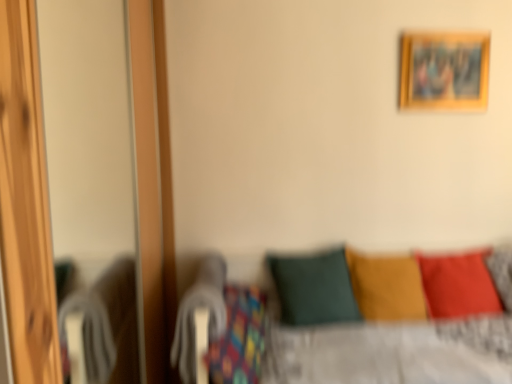
This screenshot has width=512, height=384. Identify the location of matte red pillow at lower right, positioned as the 3th pillow in left-to-right order. (458, 285).

What do you see at coordinates (444, 71) in the screenshot?
I see `wooden picture frame at upper right` at bounding box center [444, 71].

How much space does dark green fabric pillow at center, marked as the 1th pillow in a left-to-right arrangement, occupy horizontally?

The width of dark green fabric pillow at center, marked as the 1th pillow in a left-to-right arrangement, is 16.09 inches.

The width and height of the screenshot is (512, 384). I want to click on wooden screen door at left, so click(x=25, y=200).

The height and width of the screenshot is (384, 512). Find the location of `velvet yellow pillow at center, which is the second pillow in right-to-left order`. velvet yellow pillow at center, which is the second pillow in right-to-left order is located at coordinates (387, 286).

From a real-world perspective, who is located higher, wooden picture frame at upper right or wooden screen door at left?

wooden picture frame at upper right.

Is wooden picture frame at upper right situated inside wooden screen door at left or outside?

wooden picture frame at upper right is not inside wooden screen door at left, it's outside.

Considering the positions of point (482, 35) and point (34, 39), is point (482, 35) closer or farther from the camera than point (34, 39)?

Point (482, 35) is positioned farther from the camera compared to point (34, 39).

Considering the positions of objects velvet yellow pillow at center, marked as the 2th pillow in a left-to-right arrangement, and wooden picture frame at upper right in the image provided, who is more to the right, velvet yellow pillow at center, marked as the 2th pillow in a left-to-right arrangement, or wooden picture frame at upper right?

wooden picture frame at upper right.

Does point (371, 308) appear closer or farther from the camera than point (465, 61)?

Point (371, 308) is closer to the camera than point (465, 61).

Is velvet yellow pillow at center, which is the second pillow in right-to-left order, oriented away from wooden picture frame at upper right?

No, velvet yellow pillow at center, which is the second pillow in right-to-left order,'s orientation is not away from wooden picture frame at upper right.

How different are the orientations of velvet yellow pillow at center, marked as the 2th pillow in a left-to-right arrangement, and wooden picture frame at upper right in degrees?

The angular difference between velvet yellow pillow at center, marked as the 2th pillow in a left-to-right arrangement, and wooden picture frame at upper right is 2.82 degrees.

From the picture: Could you tell me if wooden screen door at left is facing dark green fabric pillow at center, placed as the 3th pillow when sorted from right to left?

Yes, wooden screen door at left faces towards dark green fabric pillow at center, placed as the 3th pillow when sorted from right to left.

Identify the location of screen door located in front of the dark green fabric pillow at center, marked as the 1th pillow in a left-to-right arrangement. (25, 200).

Can you confirm if wooden screen door at left is thinner than dark green fabric pillow at center, placed as the 3th pillow when sorted from right to left?

In fact, wooden screen door at left might be wider than dark green fabric pillow at center, placed as the 3th pillow when sorted from right to left.

Does wooden screen door at left lie behind dark green fabric pillow at center, marked as the 1th pillow in a left-to-right arrangement?

No, wooden screen door at left is closer to the camera.

Is matte red pillow at lower right, positioned as the 3th pillow in left-to-right order, to the right of dark green fabric pillow at center, marked as the 1th pillow in a left-to-right arrangement, from the viewer's perspective?

Indeed, matte red pillow at lower right, positioned as the 3th pillow in left-to-right order, is positioned on the right side of dark green fabric pillow at center, marked as the 1th pillow in a left-to-right arrangement.

Which object is further away from the camera, matte red pillow at lower right, positioned as the 3th pillow in left-to-right order, or dark green fabric pillow at center, marked as the 1th pillow in a left-to-right arrangement?

Positioned behind is matte red pillow at lower right, positioned as the 3th pillow in left-to-right order.

Considering the relative sizes of matte red pillow at lower right, positioned as the 3th pillow in left-to-right order, and dark green fabric pillow at center, marked as the 1th pillow in a left-to-right arrangement, in the image provided, is matte red pillow at lower right, positioned as the 3th pillow in left-to-right order, bigger than dark green fabric pillow at center, marked as the 1th pillow in a left-to-right arrangement,?

Actually, matte red pillow at lower right, positioned as the 3th pillow in left-to-right order, might be smaller than dark green fabric pillow at center, marked as the 1th pillow in a left-to-right arrangement.

What's the angular difference between matte red pillow at lower right, which appears as the 1th pillow when viewed from the right, and dark green fabric pillow at center, placed as the 3th pillow when sorted from right to left,'s facing directions?

8.66 degrees.

From a real-world perspective, is wooden picture frame at upper right under velvet yellow pillow at center, marked as the 2th pillow in a left-to-right arrangement?

No, from a real-world perspective, wooden picture frame at upper right is not under velvet yellow pillow at center, marked as the 2th pillow in a left-to-right arrangement.

Considering the sizes of objects wooden picture frame at upper right and velvet yellow pillow at center, which is the second pillow in right-to-left order, in the image provided, who is bigger, wooden picture frame at upper right or velvet yellow pillow at center, which is the second pillow in right-to-left order,?

velvet yellow pillow at center, which is the second pillow in right-to-left order, is bigger.

Image resolution: width=512 pixels, height=384 pixels. In order to click on pillow that is the 1st one when counting leftward from the wooden picture frame at upper right in this screenshot , I will do `click(387, 286)`.

From the picture: Choose the correct answer: Is wooden picture frame at upper right inside velvet yellow pillow at center, which is the second pillow in right-to-left order, or outside it?

The correct answer is: outside.

Can you confirm if matte red pillow at lower right, which appears as the 1th pillow when viewed from the right, is bigger than wooden screen door at left?

Incorrect, matte red pillow at lower right, which appears as the 1th pillow when viewed from the right, is not larger than wooden screen door at left.

From the picture: From the image's perspective, which one is positioned higher, matte red pillow at lower right, positioned as the 3th pillow in left-to-right order, or wooden screen door at left?

From the image's view, wooden screen door at left is above.

Is matte red pillow at lower right, which appears as the 1th pillow when viewed from the right, facing towards wooden screen door at left?

No, matte red pillow at lower right, which appears as the 1th pillow when viewed from the right, is not turned towards wooden screen door at left.

Identify the location of screen door above the matte red pillow at lower right, positioned as the 3th pillow in left-to-right order (from a real-world perspective). The image size is (512, 384). (25, 200).

From the image's perspective, is velvet yellow pillow at center, marked as the 2th pillow in a left-to-right arrangement, located above or below matte red pillow at lower right, which appears as the 1th pillow when viewed from the right?

velvet yellow pillow at center, marked as the 2th pillow in a left-to-right arrangement, is below matte red pillow at lower right, which appears as the 1th pillow when viewed from the right.

Consider the image. Which is more to the left, velvet yellow pillow at center, which is the second pillow in right-to-left order, or matte red pillow at lower right, which appears as the 1th pillow when viewed from the right?

velvet yellow pillow at center, which is the second pillow in right-to-left order.

Which of these two, velvet yellow pillow at center, which is the second pillow in right-to-left order, or matte red pillow at lower right, which appears as the 1th pillow when viewed from the right, is wider?

With larger width is velvet yellow pillow at center, which is the second pillow in right-to-left order.

Is velvet yellow pillow at center, marked as the 2th pillow in a left-to-right arrangement, taller or shorter than matte red pillow at lower right, positioned as the 3th pillow in left-to-right order?

Clearly, velvet yellow pillow at center, marked as the 2th pillow in a left-to-right arrangement, is shorter compared to matte red pillow at lower right, positioned as the 3th pillow in left-to-right order.

You are a GUI agent. You are given a task and a screenshot of the screen. Output one action in this format:
    pyautogui.click(x=<x>, y=<y>)
    Task: Click on the screen door that appears below the wooden picture frame at upper right (from a real-world perspective)
    
    Given the screenshot: What is the action you would take?
    pyautogui.click(x=25, y=200)

Locate an element on the screen. the 1st pillow to the left of the wooden picture frame at upper right, counting from the anchor's position is located at coordinates (387, 286).

When comparing their distances from wooden screen door at left, does velvet yellow pillow at center, marked as the 2th pillow in a left-to-right arrangement, or dark green fabric pillow at center, placed as the 3th pillow when sorted from right to left, seem closer?

Among the two, dark green fabric pillow at center, placed as the 3th pillow when sorted from right to left, is located nearer to wooden screen door at left.

Estimate the real-world distances between objects in this image. Which object is further from wooden picture frame at upper right, wooden screen door at left or velvet yellow pillow at center, marked as the 2th pillow in a left-to-right arrangement?

Among the two, wooden screen door at left is located further to wooden picture frame at upper right.

Estimate the real-world distances between objects in this image. Which object is further from dark green fabric pillow at center, marked as the 1th pillow in a left-to-right arrangement, wooden screen door at left or matte red pillow at lower right, which appears as the 1th pillow when viewed from the right?

wooden screen door at left is positioned further to the anchor dark green fabric pillow at center, marked as the 1th pillow in a left-to-right arrangement.

Looking at this image, estimate the real-world distances between objects in this image. Which object is further from wooden screen door at left, velvet yellow pillow at center, which is the second pillow in right-to-left order, or wooden picture frame at upper right?

wooden picture frame at upper right is further to wooden screen door at left.

From the image, which object appears to be nearer to dark green fabric pillow at center, placed as the 3th pillow when sorted from right to left, matte red pillow at lower right, positioned as the 3th pillow in left-to-right order, or velvet yellow pillow at center, marked as the 2th pillow in a left-to-right arrangement?

velvet yellow pillow at center, marked as the 2th pillow in a left-to-right arrangement.

Looking at the image, which one is located further to wooden screen door at left, matte red pillow at lower right, which appears as the 1th pillow when viewed from the right, or velvet yellow pillow at center, which is the second pillow in right-to-left order?

matte red pillow at lower right, which appears as the 1th pillow when viewed from the right, is positioned further to the anchor wooden screen door at left.

Which object lies nearer to the anchor point velvet yellow pillow at center, marked as the 2th pillow in a left-to-right arrangement, wooden picture frame at upper right or matte red pillow at lower right, which appears as the 1th pillow when viewed from the right?

matte red pillow at lower right, which appears as the 1th pillow when viewed from the right, is closer to velvet yellow pillow at center, marked as the 2th pillow in a left-to-right arrangement.

From the image, which object appears to be nearer to wooden picture frame at upper right, dark green fabric pillow at center, placed as the 3th pillow when sorted from right to left, or wooden screen door at left?

dark green fabric pillow at center, placed as the 3th pillow when sorted from right to left, lies closer to wooden picture frame at upper right than the other object.

The height and width of the screenshot is (384, 512). Find the location of `pillow between wooden picture frame at upper right and velvet yellow pillow at center, which is the second pillow in right-to-left order, in the vertical direction`. pillow between wooden picture frame at upper right and velvet yellow pillow at center, which is the second pillow in right-to-left order, in the vertical direction is located at coordinates (458, 285).

The width and height of the screenshot is (512, 384). I want to click on pillow positioned between wooden screen door at left and velvet yellow pillow at center, which is the second pillow in right-to-left order, from near to far, so click(x=314, y=288).

This screenshot has width=512, height=384. Find the location of `pillow located between dark green fabric pillow at center, marked as the 1th pillow in a left-to-right arrangement, and matte red pillow at lower right, positioned as the 3th pillow in left-to-right order, in the left-right direction`. pillow located between dark green fabric pillow at center, marked as the 1th pillow in a left-to-right arrangement, and matte red pillow at lower right, positioned as the 3th pillow in left-to-right order, in the left-right direction is located at coordinates (387, 286).